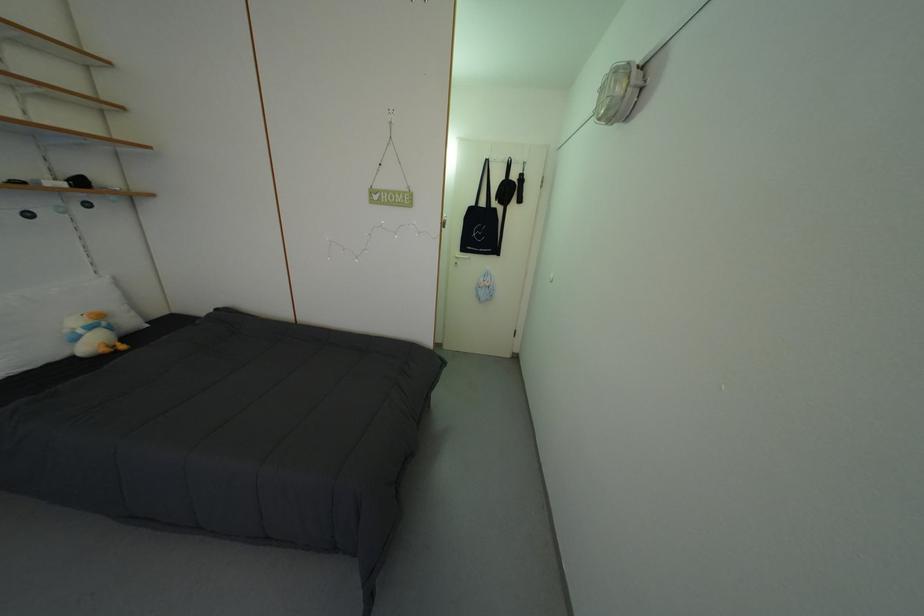
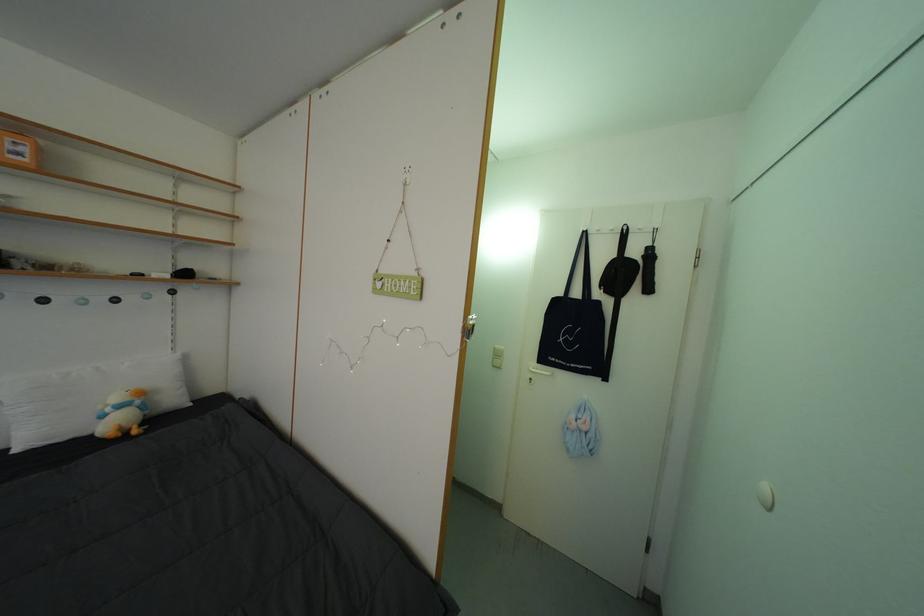
In the second image, find the point that corresponds to (x=90, y=338) in the first image.

(117, 415)